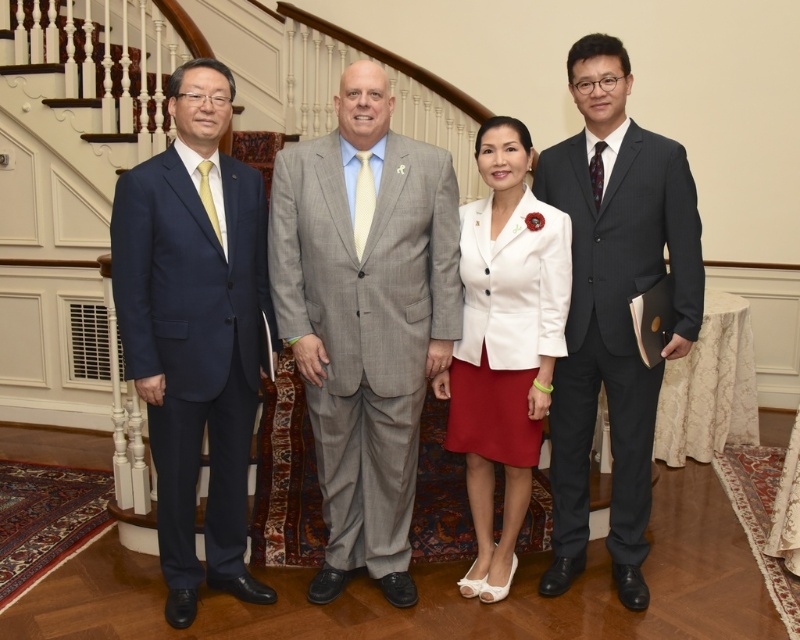
Question: Does matte black suit at center lie behind dark gray pinstripe suit at right?

Choices:
 (A) yes
 (B) no

Answer: (B)

Question: Which object appears closest to the camera in this image?

Choices:
 (A) matte black suit at center
 (B) white matte blazer at center

Answer: (A)

Question: Based on their relative distances, which object is nearer to the gray textured suit at center?

Choices:
 (A) white matte blazer at center
 (B) matte blue suit at left
 (C) matte black suit at center

Answer: (C)

Question: Is matte blue suit at left to the left of white matte blazer at center from the viewer's perspective?

Choices:
 (A) yes
 (B) no

Answer: (A)

Question: Which point appears closest to the camera in this image?

Choices:
 (A) (594, 410)
 (B) (508, 333)

Answer: (B)

Question: Is matte black suit at center bigger than dark gray pinstripe suit at right?

Choices:
 (A) no
 (B) yes

Answer: (B)